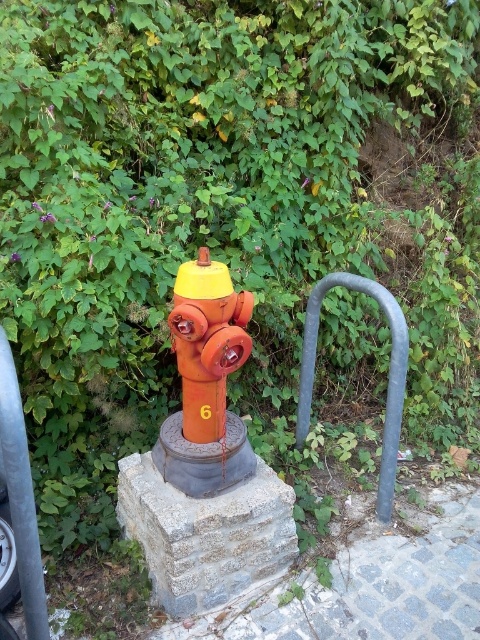
Question: Does matte orange fire hydrant at center have a greater width compared to brushed metal rail at left?

Choices:
 (A) yes
 (B) no

Answer: (A)

Question: Does brushed metal rail at left come in front of metallic gray rail at center right?

Choices:
 (A) no
 (B) yes

Answer: (B)

Question: Which is farther from the brushed metal rail at left?

Choices:
 (A) metallic gray rail at center right
 (B) matte orange fire hydrant at center

Answer: (A)

Question: Is matte orange fire hydrant at center further to the viewer compared to metallic gray rail at center right?

Choices:
 (A) yes
 (B) no

Answer: (B)

Question: Which of the following is the farthest from the observer?

Choices:
 (A) matte orange fire hydrant at center
 (B) brushed metal rail at left
 (C) metallic gray rail at center right

Answer: (C)

Question: Which object is closer to the camera taking this photo?

Choices:
 (A) matte orange fire hydrant at center
 (B) metallic gray rail at center right

Answer: (A)